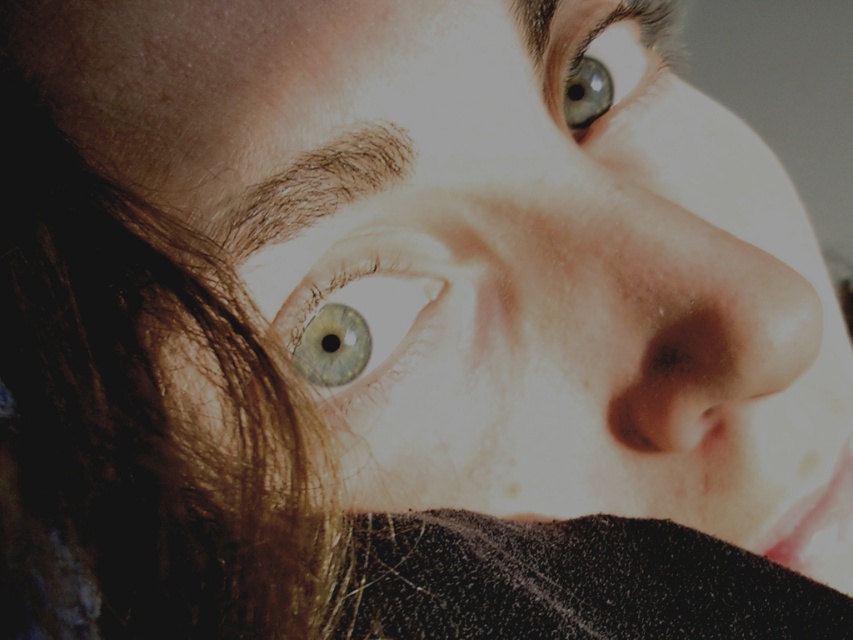
You are a photographer adjusting the focus on your camera. You want to ensure both the light blue glossy eye at center and the dark pupil inside it are in focus. Given that the depth of field can only cover 30 centimeters, will you be able to capture both in focus?

The light blue glossy eye at center and the dark pupil inside it are 31.90 centimeters apart. Since the depth of field can only cover 30 centimeters, you will not be able to capture both in focus.

You are an artist trying to paint the eyes in the portrait. The light blue glossy eye at center and the matte blue eye at upper center are both important. Which eye should you make wider to match their actual sizes as shown in the image?

The matte blue eye at upper center should be painted wider because the light blue glossy eye at center is narrower than the matte blue eye at upper center in the image.